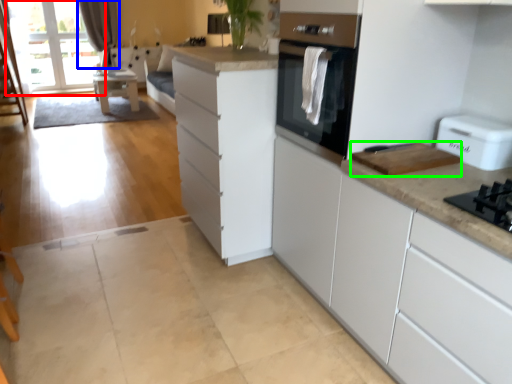
Question: Which is farther away from window screen (highlighted by a red box)? curtain (highlighted by a blue box) or appliance (highlighted by a green box)?

Choices:
 (A) curtain
 (B) appliance

Answer: (B)